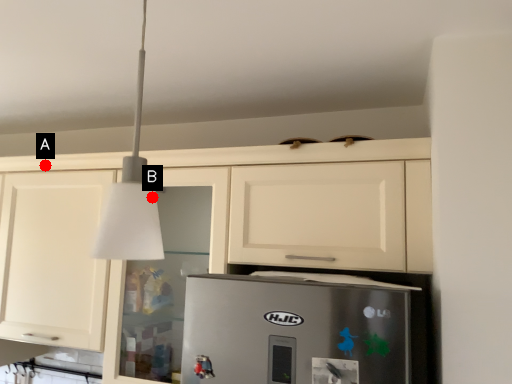
Question: Two points are circled on the image, labeled by A and B beside each circle. Which point appears closest to the camera in this image?

Choices:
 (A) A is closer
 (B) B is closer

Answer: (B)